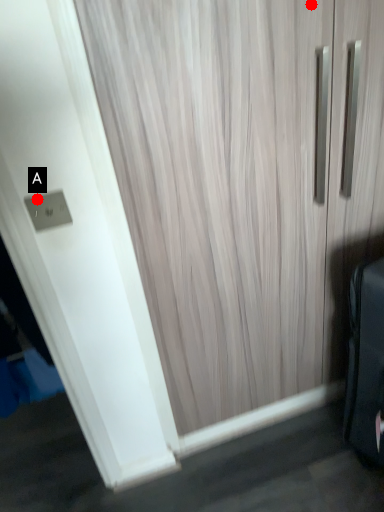
Question: Two points are circled on the image, labeled by A and B beside each circle. Which point is closer to the camera?

Choices:
 (A) A is closer
 (B) B is closer

Answer: (B)